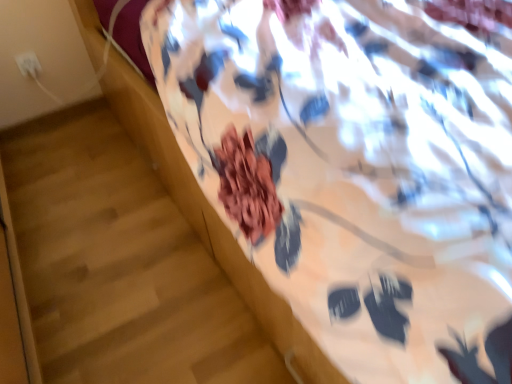
The height and width of the screenshot is (384, 512). Find the location of `white plastic electric outlet at upper left`. white plastic electric outlet at upper left is located at coordinates click(x=28, y=64).

Describe the element at coordinates (28, 64) in the screenshot. The width and height of the screenshot is (512, 384). I see `white plastic electric outlet at upper left` at that location.

Locate an element on the screen. white plastic electric outlet at upper left is located at coordinates pos(28,64).